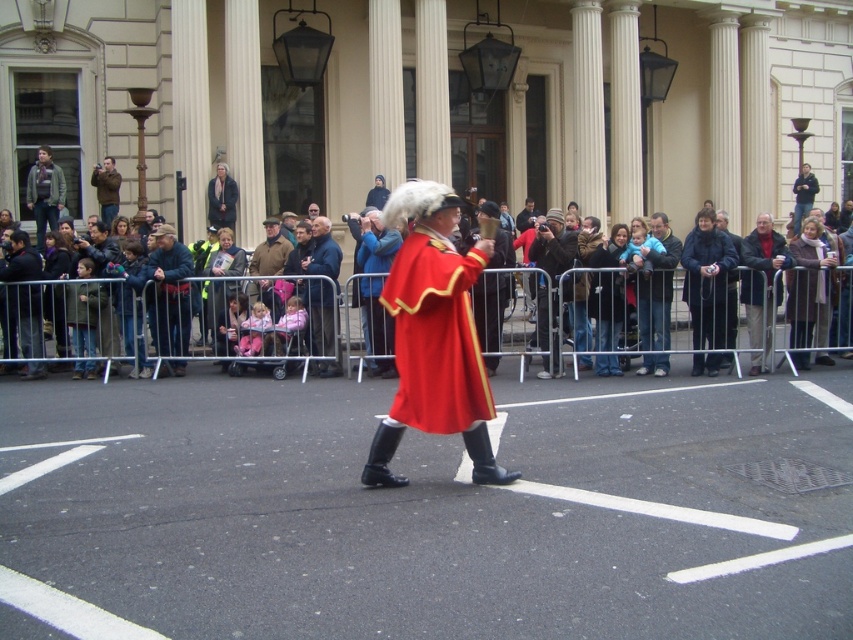
Question: Does smooth brown coat at center have a greater width compared to brown leather jacket at center?

Choices:
 (A) yes
 (B) no

Answer: (B)

Question: Can you confirm if smooth brown coat at center is wider than gray wool jacket at upper left?

Choices:
 (A) yes
 (B) no

Answer: (B)

Question: Which object is closer to the camera taking this photo?

Choices:
 (A) red velvet coat at center
 (B) gray wool jacket at upper left

Answer: (A)

Question: Considering the relative positions of matte red coat at center and smooth brown coat at center in the image provided, where is matte red coat at center located with respect to smooth brown coat at center?

Choices:
 (A) above
 (B) below

Answer: (B)

Question: Considering the real-world distances, which object is farthest from the smooth brown coat at center?

Choices:
 (A) brown leather jacket at center
 (B) red velvet coat at center

Answer: (A)

Question: Which point is farther to the camera?

Choices:
 (A) matte red coat at center
 (B) red velvet coat at center
 (C) gray wool jacket at upper left

Answer: (C)